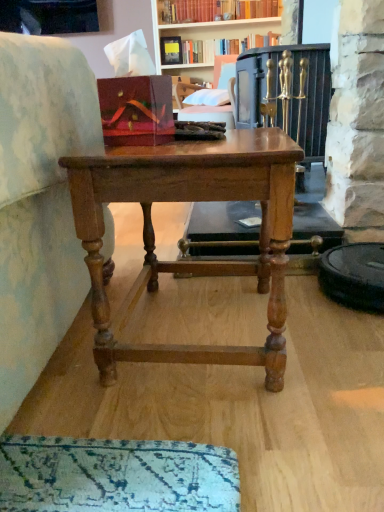
Question: Looking at the image, does velvet pink cushion at upper center seem bigger or smaller compared to hardcover book at upper center?

Choices:
 (A) big
 (B) small

Answer: (A)

Question: Is velvet pink cushion at upper center in front of or behind hardcover book at upper center in the image?

Choices:
 (A) front
 (B) behind

Answer: (A)

Question: Considering the real-world distances, which object is farthest from the hardcover book at upper center?

Choices:
 (A) wooden table at center
 (B) velvet pink cushion at upper center

Answer: (A)

Question: Estimate the real-world distances between objects in this image. Which object is closer to the hardcover book at upper center?

Choices:
 (A) wooden table at center
 (B) velvet pink cushion at upper center

Answer: (B)